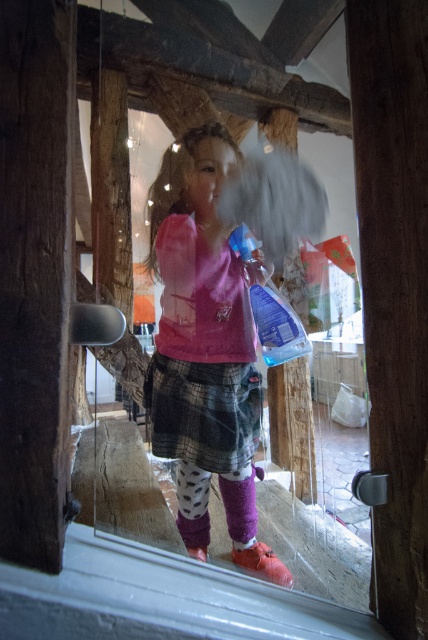
Where is `transparent plastic bottle at center`? transparent plastic bottle at center is located at coordinates (276, 324).

Which is in front, point (291, 314) or point (240, 499)?

Positioned in front is point (291, 314).

You are a GUI agent. You are given a task and a screenshot of the screen. Output one action in this format:
    pyautogui.click(x=<x>, y=<y>)
    Task: Click on the transparent plastic bottle at center
    
    Given the screenshot: What is the action you would take?
    pyautogui.click(x=276, y=324)

From the picture: Which is below, pink fabric shirt at center or purple fuzzy sock at lower center?

Positioned lower is purple fuzzy sock at lower center.

Who is taller, pink fabric shirt at center or purple fuzzy sock at lower center?

Standing taller between the two is pink fabric shirt at center.

Which is in front, point (231, 378) or point (243, 528)?

Positioned in front is point (231, 378).

Where is `pink fabric shirt at center`? The width and height of the screenshot is (428, 640). pink fabric shirt at center is located at coordinates (202, 312).

Does brown wooden door at center appear on the left side of transparent plastic bottle at center?

In fact, brown wooden door at center is to the right of transparent plastic bottle at center.

Does point (413, 125) lie behind point (276, 340)?

No, it is not.

Is point (368, 145) positioned behind point (267, 356)?

No, it is in front of (267, 356).

In order to click on brown wooden door at center in this screenshot , I will do `click(394, 285)`.